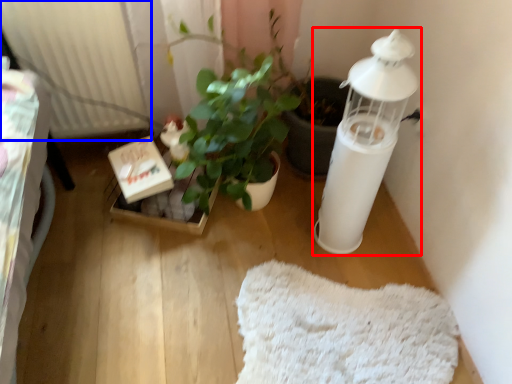
Question: Among these objects, which one is nearest to the camera, candle holder (highlighted by a red box) or radiator (highlighted by a blue box)?

Choices:
 (A) candle holder
 (B) radiator

Answer: (A)